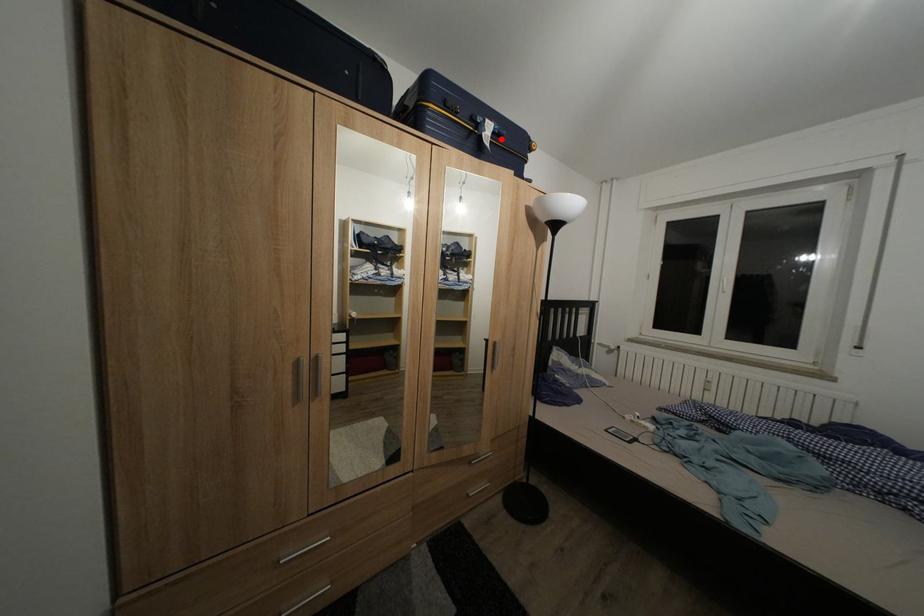
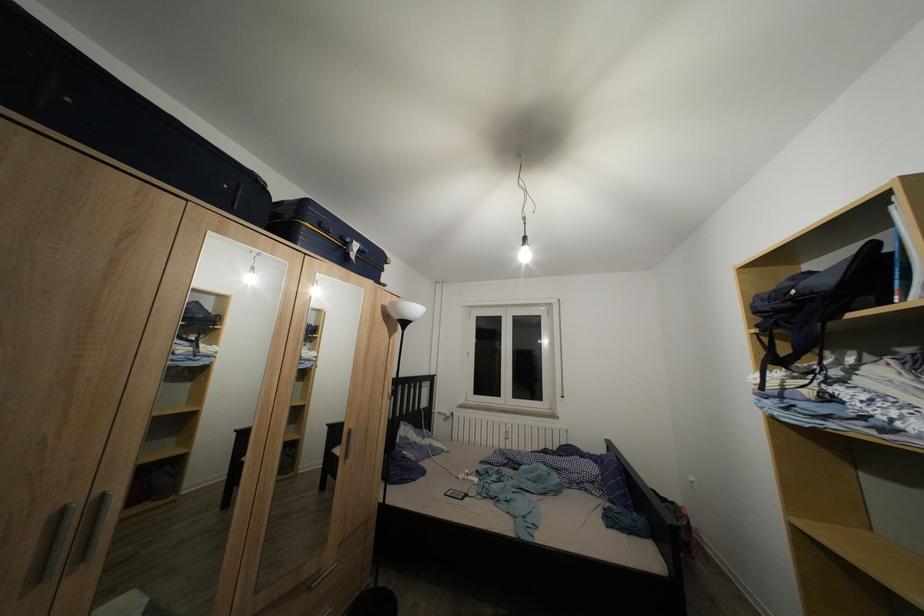
Question: I am providing you with two images of the same scene from different viewpoints. A red point is marked on the first image. Is the red point's position out of view in image 2?

Choices:
 (A) Yes
 (B) No

Answer: (B)